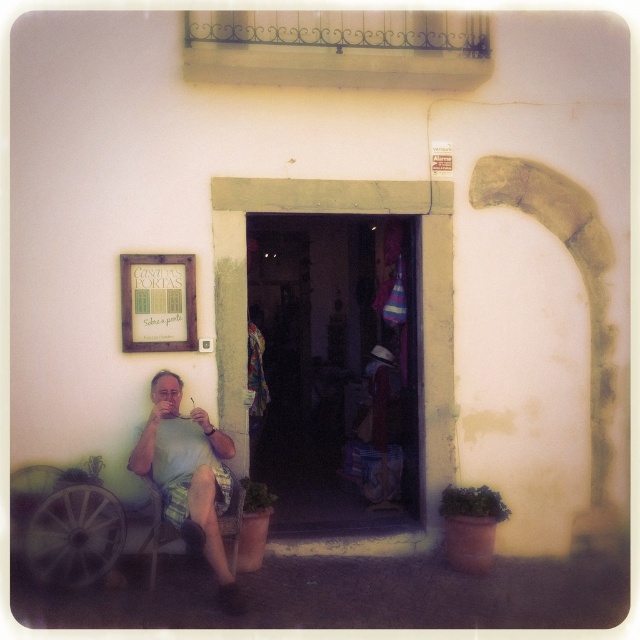
You are standing in front of the building and notice the white fabric shirt at left and the green striped shorts at lower left. Which clothing item is positioned more to the left side?

The white fabric shirt at left is positioned more to the left than the green striped shorts at lower left.